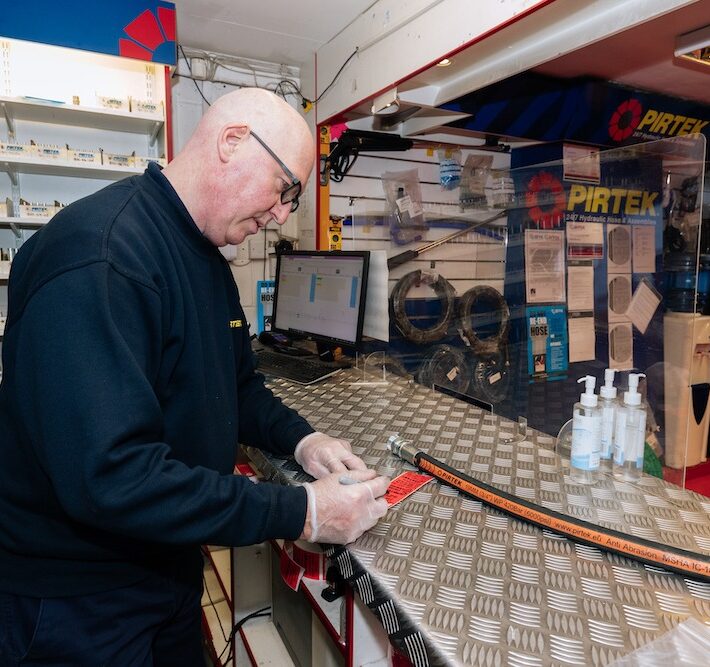
At what (x,y) coordinates should I click in order to perform the action: click on bottles of hand sanitizer. Please return your answer as a coordinate pair (x, y). This screenshot has height=667, width=710. Looking at the image, I should click on (572, 417), (611, 408), (635, 424).